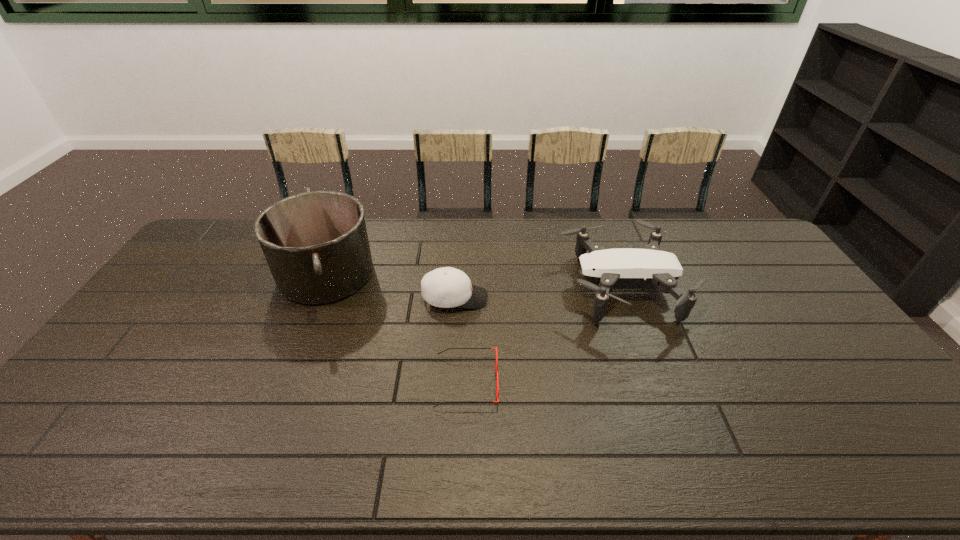
Identify which object is the second nearest to the nearest object. Please provide its 2D coordinates. Your answer should be formatted as a tuple, i.e. [(x, y)], where the tuple contains the x and y coordinates of a point satisfying the conditions above.

[(604, 269)]